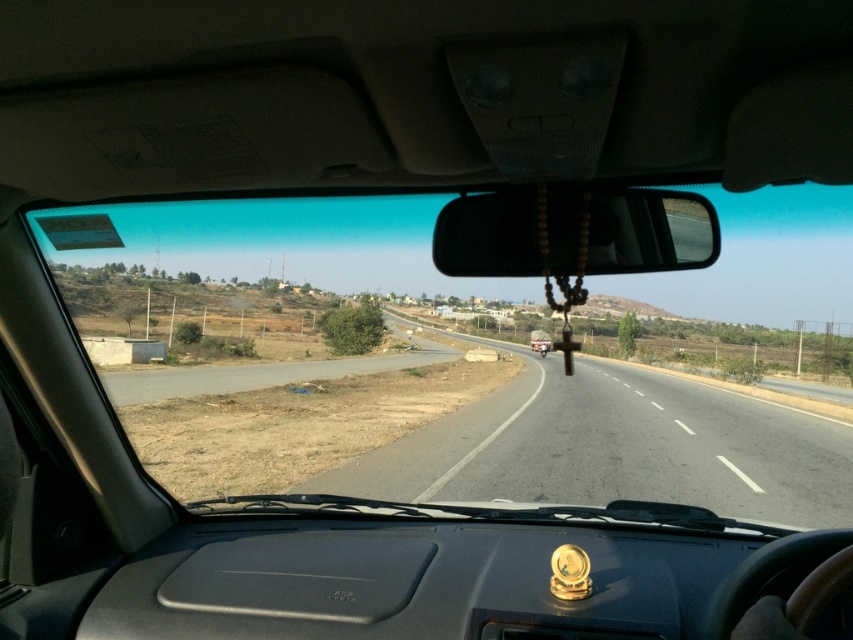
Is wooden beads at center bigger than metallic silver helmet at center?

No, wooden beads at center is not bigger than metallic silver helmet at center.

Does wooden beads at center appear over metallic silver helmet at center?

Correct, wooden beads at center is located above metallic silver helmet at center.

You are a GUI agent. You are given a task and a screenshot of the screen. Output one action in this format:
    pyautogui.click(x=<x>, y=<y>)
    Task: Click on the wooden beads at center
    Image resolution: width=853 pixels, height=640 pixels.
    Given the screenshot: What is the action you would take?
    pyautogui.click(x=573, y=232)

The width and height of the screenshot is (853, 640). Find the location of `wooden beads at center`. wooden beads at center is located at coordinates (573, 232).